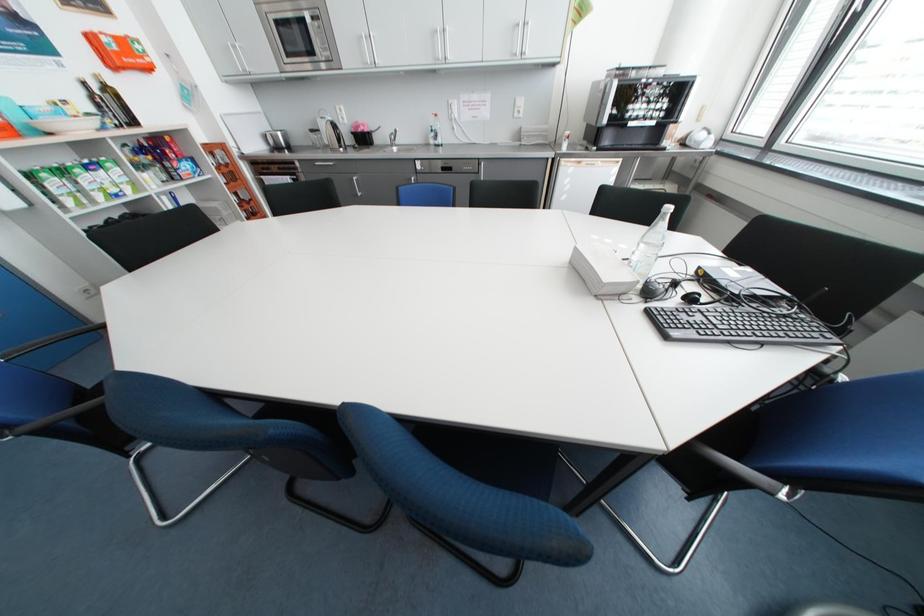
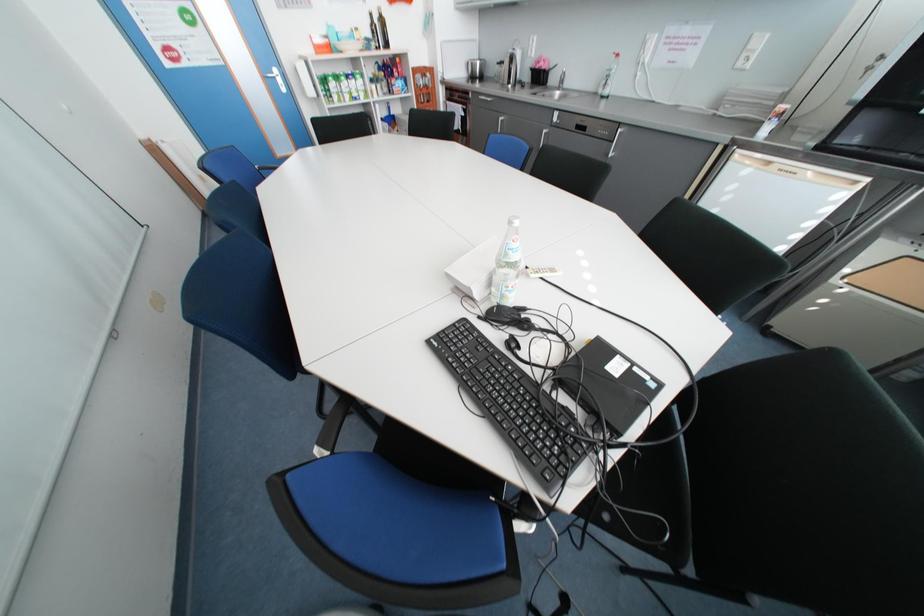
First-person continuous shooting, in which direction is the camera rotating?

The camera's rotation is toward left-down.